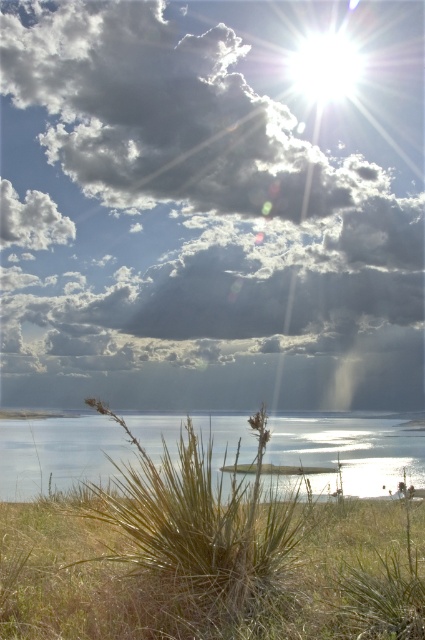
Question: Considering the real-world distances, which object is farthest from the green grass at lower left?

Choices:
 (A) clear water at lower center
 (B) cloudy sky at upper center
 (C) green textured grass at lower center

Answer: (B)

Question: Does cloudy sky at upper center lie in front of clear water at lower center?

Choices:
 (A) yes
 (B) no

Answer: (B)

Question: Which object is positioned closest to the cloudy sky at upper center?

Choices:
 (A) green grass at lower left
 (B) clear water at lower center

Answer: (B)

Question: Is cloudy sky at upper center bigger than green textured grass at lower center?

Choices:
 (A) yes
 (B) no

Answer: (A)

Question: Does cloudy sky at upper center have a greater width compared to clear water at lower center?

Choices:
 (A) yes
 (B) no

Answer: (A)

Question: Among these points, which one is nearest to the camera?

Choices:
 (A) (416, 3)
 (B) (218, 625)
 (C) (141, 497)
 (D) (214, 428)

Answer: (B)